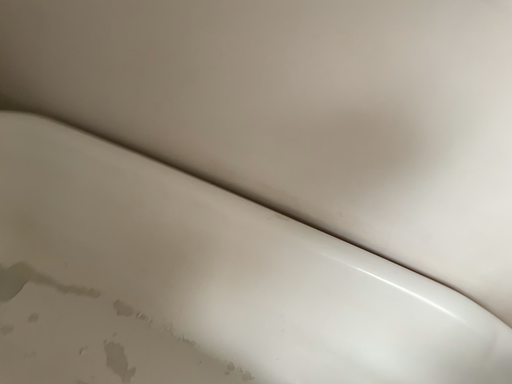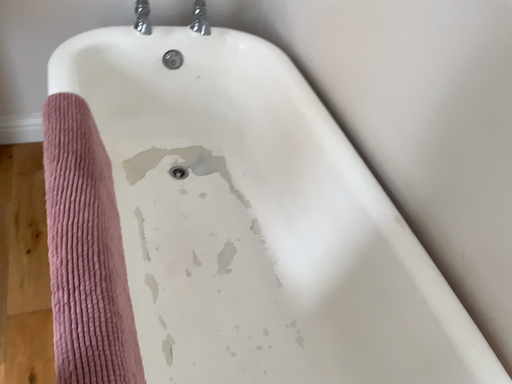
Question: How did the camera likely rotate when shooting the video?

Choices:
 (A) rotated downward
 (B) rotated upward

Answer: (B)